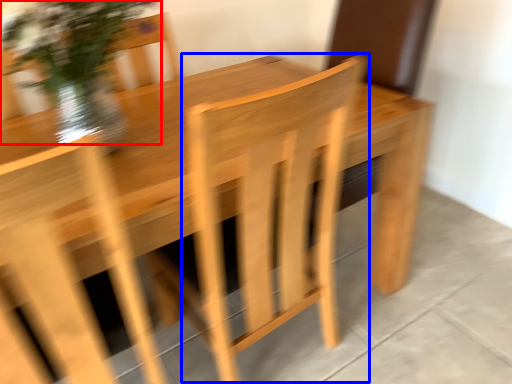
Question: Which point is closer to the camera, floral arrangement (highlighted by a red box) or armchair (highlighted by a blue box)?

Choices:
 (A) floral arrangement
 (B) armchair

Answer: (B)